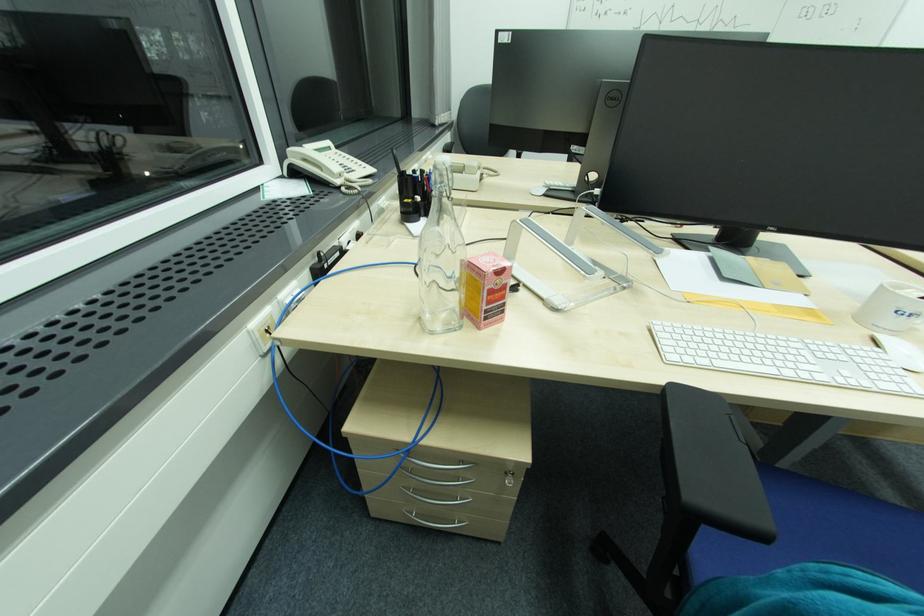
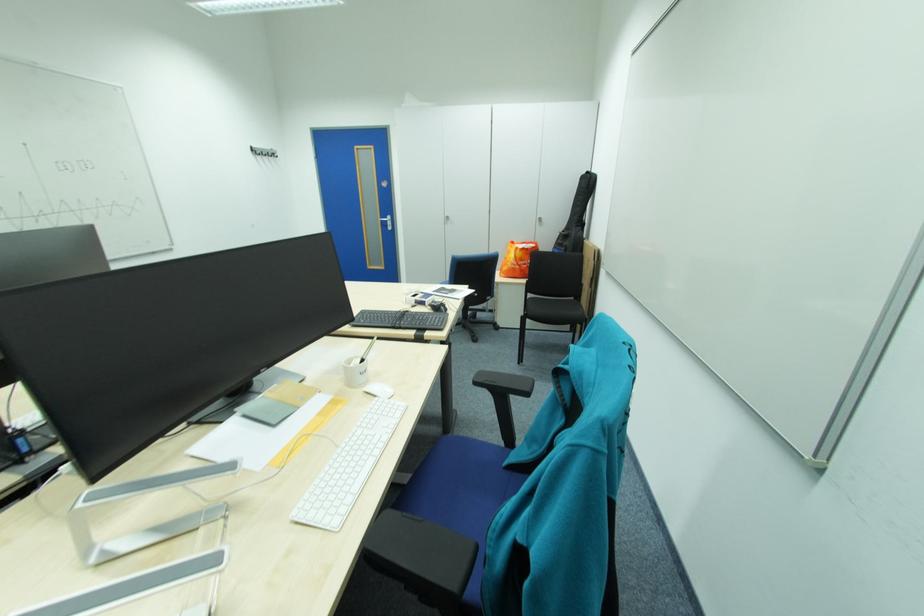
Find the pixel in the second image that matches (892,338) in the first image.

(378, 389)